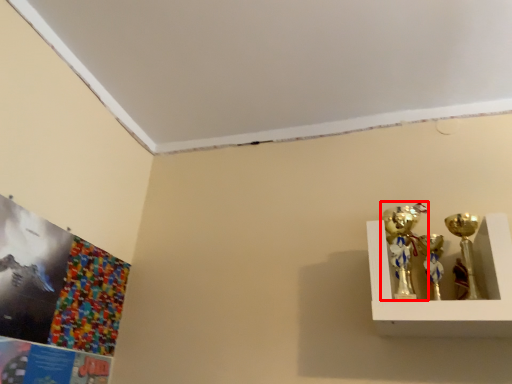
Question: From the image, what is the correct spatial relationship of candle holder (annotated by the red box) in relation to candle holder?

Choices:
 (A) right
 (B) left

Answer: (B)